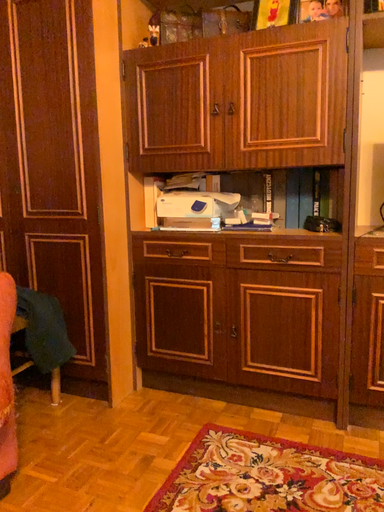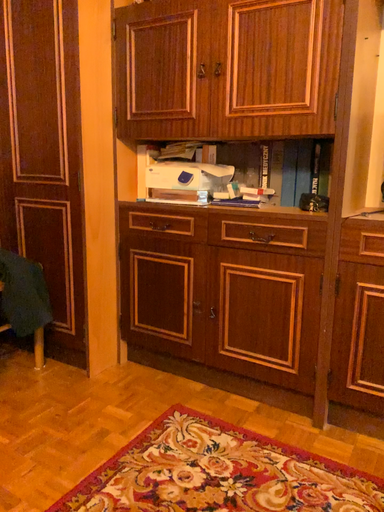
Question: How did the camera likely rotate when shooting the video?

Choices:
 (A) rotated left
 (B) rotated right

Answer: (A)